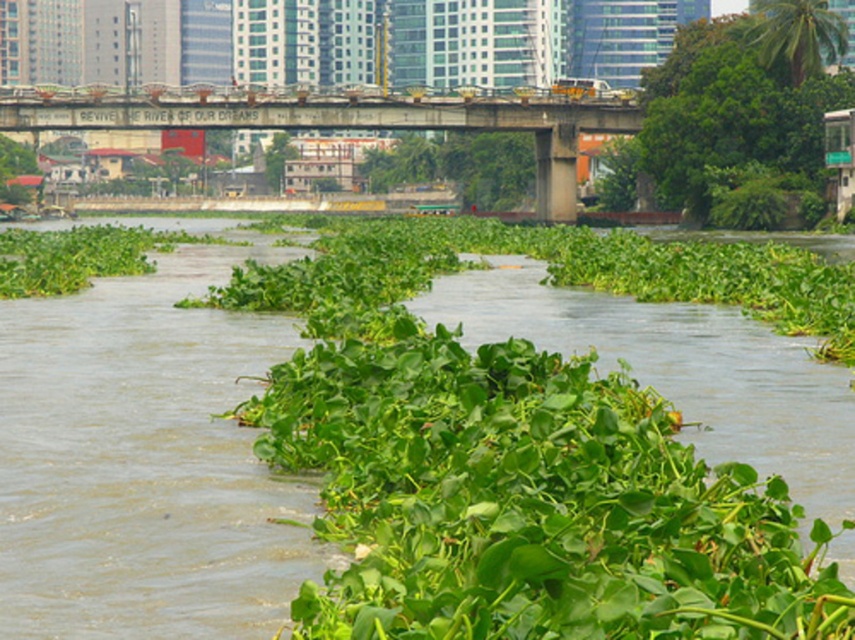
Who is positioned more to the right, green leafy plant at upper right or concrete bridge at upper center?

Positioned to the right is green leafy plant at upper right.

In the scene shown: Does green leafy plant at upper right have a greater height compared to concrete bridge at upper center?

Indeed, green leafy plant at upper right has a greater height compared to concrete bridge at upper center.

This screenshot has height=640, width=855. I want to click on green leafy plant at upper right, so click(730, 108).

Between green leafy vegetation at center and concrete bridge at upper center, which one is positioned higher?

concrete bridge at upper center

Identify the location of green leafy vegetation at center. The height and width of the screenshot is (640, 855). (127, 451).

Is point (101, 621) behind point (528, 106)?

No, it is not.

Locate an element on the screen. This screenshot has height=640, width=855. green leafy vegetation at center is located at coordinates (127, 451).

Does green leafy vegetation at center appear over green leafy plant at upper right?

Actually, green leafy vegetation at center is below green leafy plant at upper right.

Between point (171, 390) and point (799, 76), which one is positioned in front?

Positioned in front is point (171, 390).

Find the location of a particular element. This screenshot has width=855, height=640. green leafy vegetation at center is located at coordinates (127, 451).